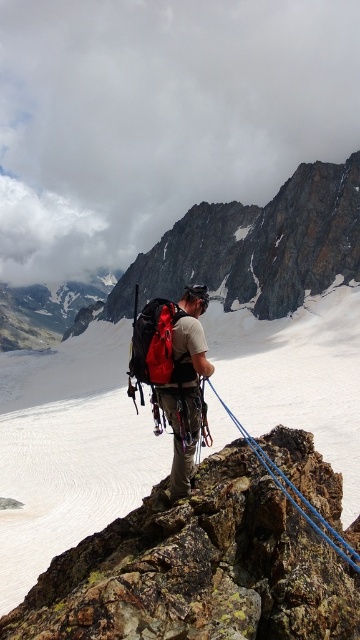
You are a mountaineer planning to secure your position on the rocky outcrop. You have the rusty rock at center and the blue nylon rope at center in your view. Which object is closer to you based on their positions?

The rusty rock at center is closer to you than the blue nylon rope at center because it is positioned in front of the blue nylon rope at center.

You are a mountaineer planning to set up a campsite. You have a map with coordinates. There is a point at coordinates point (198, 570). According to the scene, what is the terrain like at that point?

The point (198, 570) is on rusty rock at center.